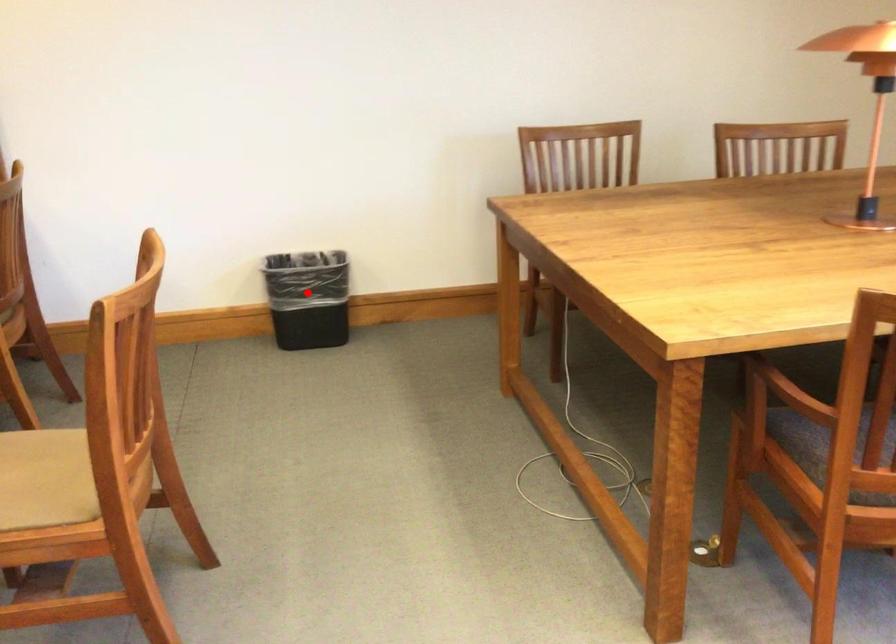
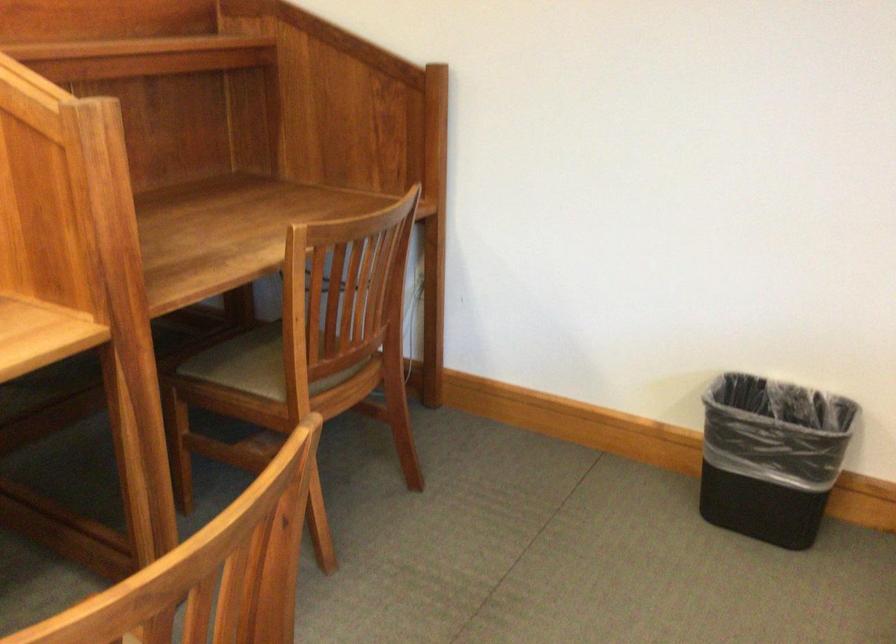
Question: I am providing you with two images of the same scene from different viewpoints. Given a red point in image1, look at the same physical point in image2. Is it:

Choices:
 (A) Closer to the viewpoint
 (B) Farther from the viewpoint

Answer: (A)